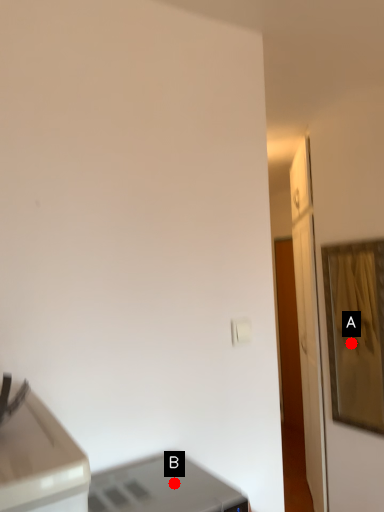
Question: Two points are circled on the image, labeled by A and B beside each circle. Which of the following is the farthest from the observer?

Choices:
 (A) A is further
 (B) B is further

Answer: (A)